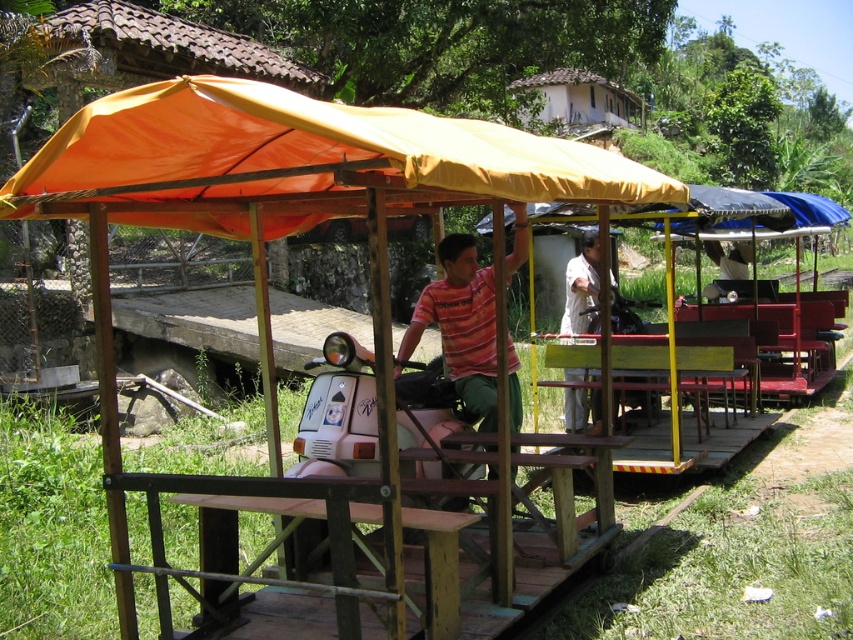
You are a passenger on the train and need to find a place to hold onto. The orange fabric canopy at upper center and the white matte shirt at center are both in your view. Which object is wider and can provide a better grip?

The orange fabric canopy at upper center is wider than the white matte shirt at center, so it can provide a better grip.

You are a passenger on the train and want to stay under the shade of the orange fabric canopy at upper center while the train moves. Where should you stand relative to the white matte shirt at center?

You should stand directly above the white matte shirt at center because the orange fabric canopy at upper center is positioned over it, providing shade.

You are a passenger on the orange fabric canopy at upper center and want to hand a map to the white matte shirt at center. Can you directly hand it to them without leaving your seat?

The orange fabric canopy at upper center is closer to the viewer than the white matte shirt at center, so you cannot directly hand the map to them without leaving your seat because they are further away.